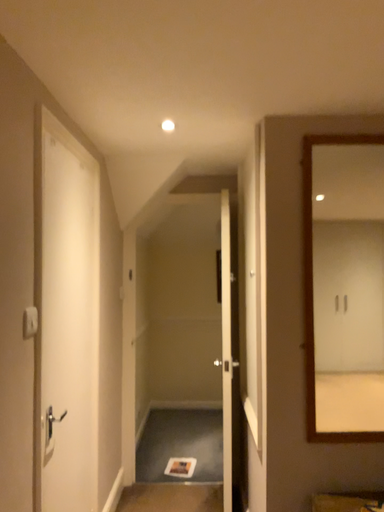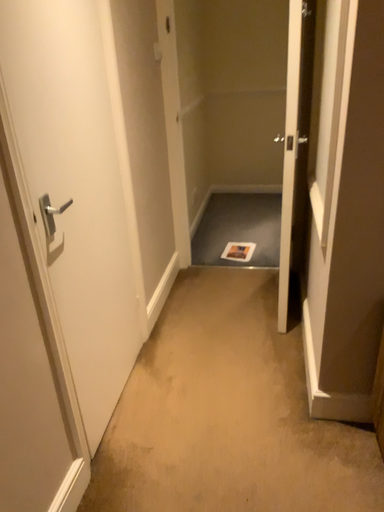
Question: Which way did the camera rotate in the video?

Choices:
 (A) rotated upward
 (B) rotated downward

Answer: (B)